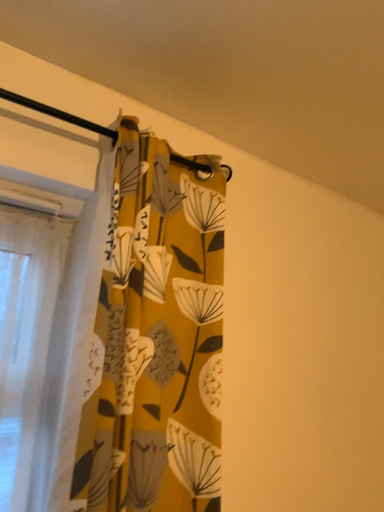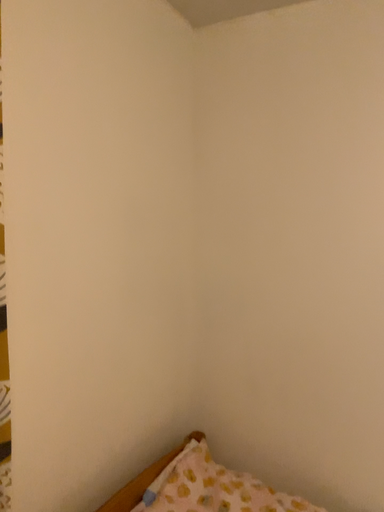
Question: How did the camera likely rotate when shooting the video?

Choices:
 (A) rotated downward
 (B) rotated upward

Answer: (A)